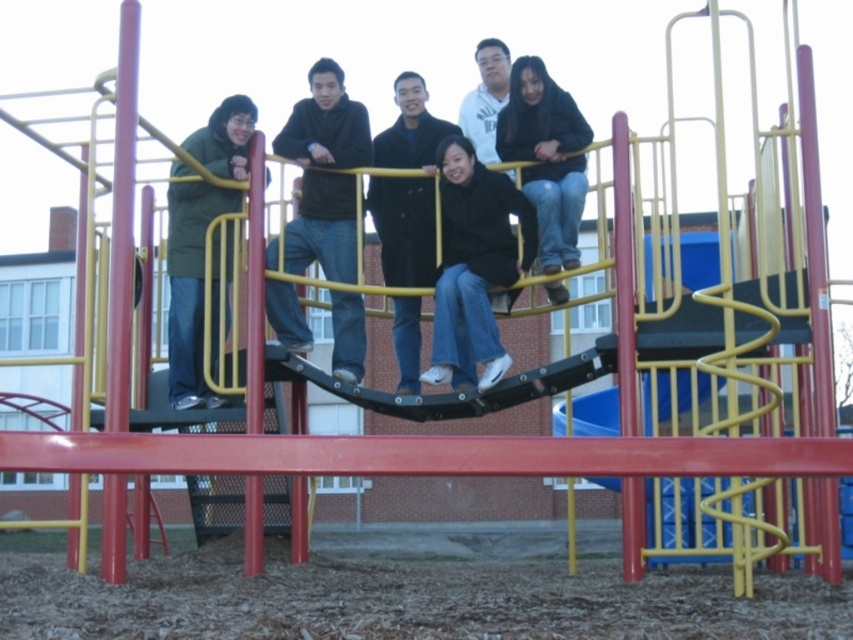
Question: Which is nearer to the dark blue coat at center?

Choices:
 (A) black matte jacket at center
 (B) dark blue jeans at center
 (C) green matte jacket at left
 (D) denim jeans at center

Answer: (B)

Question: Which of the following is the closest to the observer?

Choices:
 (A) (402, 339)
 (B) (496, 115)

Answer: (A)

Question: Is black matte jacket at center smaller than white matte jacket at upper center?

Choices:
 (A) yes
 (B) no

Answer: (A)

Question: Can you confirm if black matte jacket at center is positioned below denim jeans at center?

Choices:
 (A) no
 (B) yes

Answer: (B)

Question: Does green matte jacket at left have a larger size compared to denim jeans at center?

Choices:
 (A) yes
 (B) no

Answer: (A)

Question: Among these points, which one is nearest to the camera?

Choices:
 (A) (495, 124)
 (B) (177, 243)
 (C) (567, 264)
 (D) (270, 250)

Answer: (C)